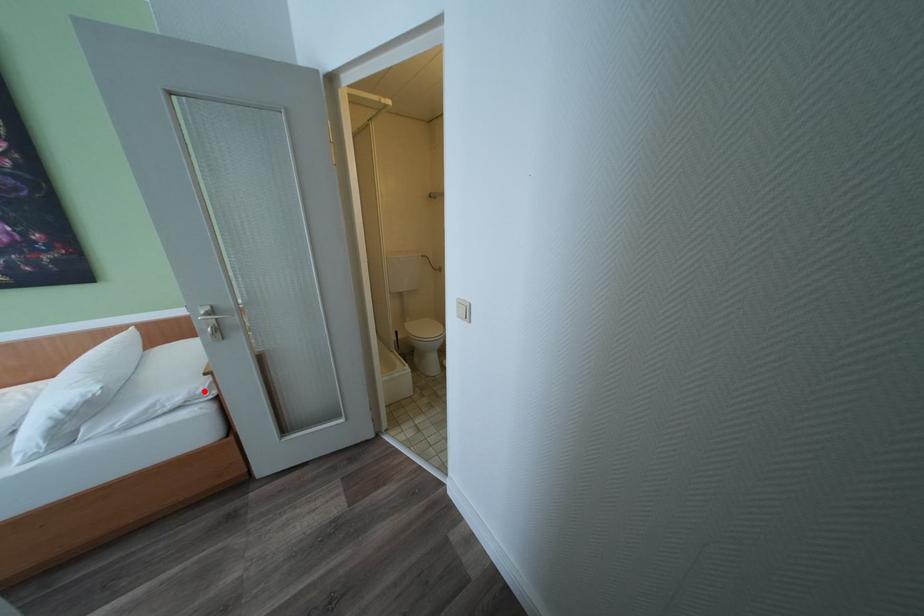
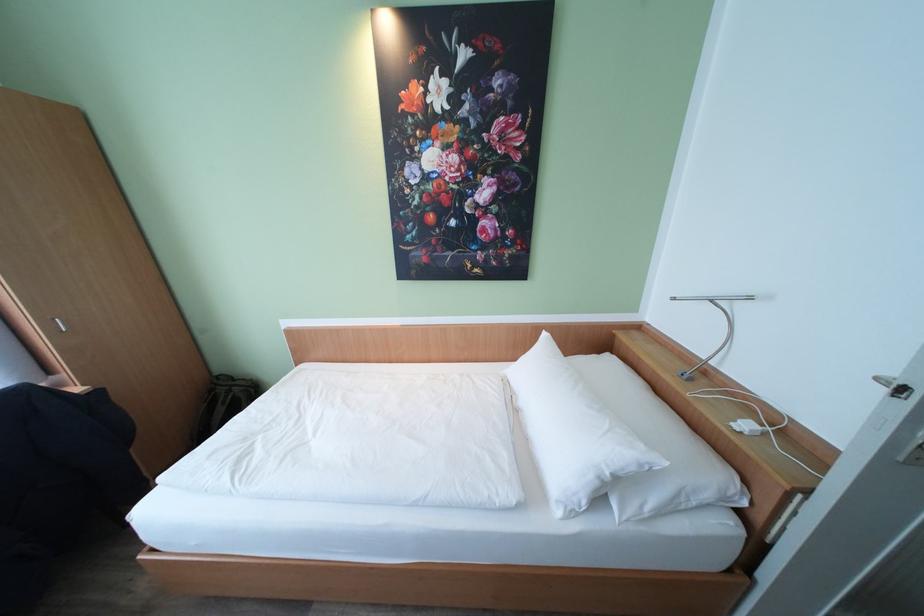
The point at the highlighted location is marked in the first image. Where is the corresponding point in the second image?

(736, 488)